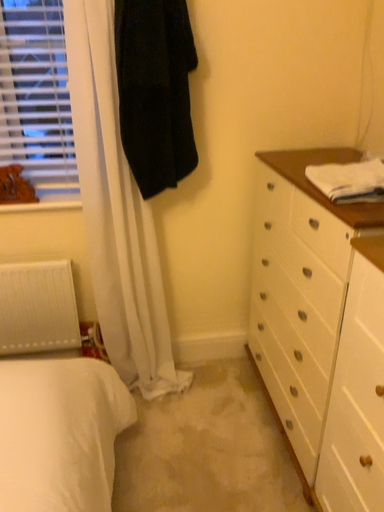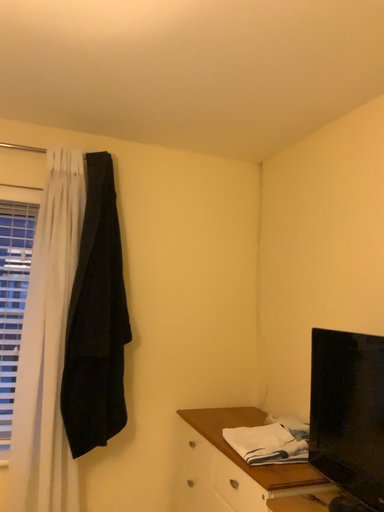
Question: How did the camera likely rotate when shooting the video?

Choices:
 (A) rotated downward
 (B) rotated upward

Answer: (B)